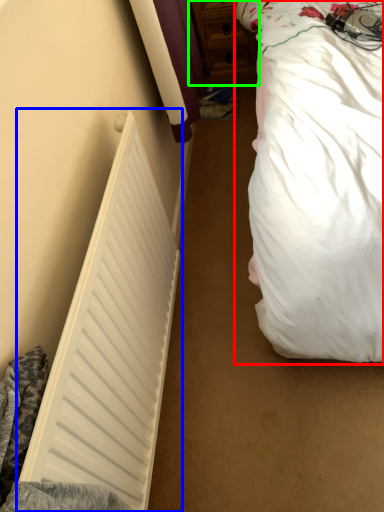
Question: Considering the real-world distances, which object is closest to bed (highlighted by a red box)? radiator (highlighted by a blue box) or dresser (highlighted by a green box).

Choices:
 (A) radiator
 (B) dresser

Answer: (A)